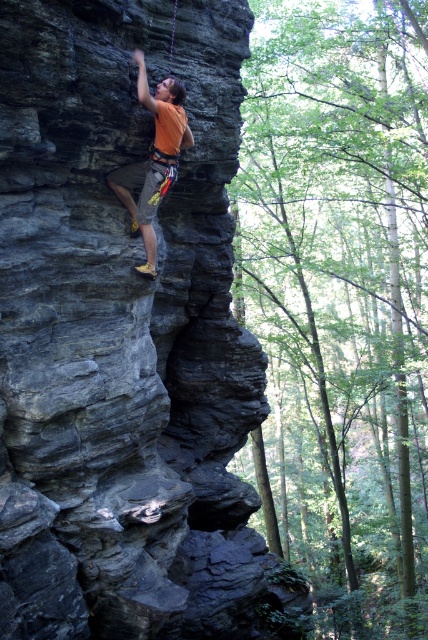
Can you confirm if dark gray stone cliff at center is taller than orange fabric climbing harness at upper center?

Correct, dark gray stone cliff at center is much taller as orange fabric climbing harness at upper center.

Does dark gray stone cliff at center appear on the right side of orange fabric climbing harness at upper center?

A: Correct, you'll find dark gray stone cliff at center to the right of orange fabric climbing harness at upper center.

Locate an element on the screen. The height and width of the screenshot is (640, 428). dark gray stone cliff at center is located at coordinates (124, 339).